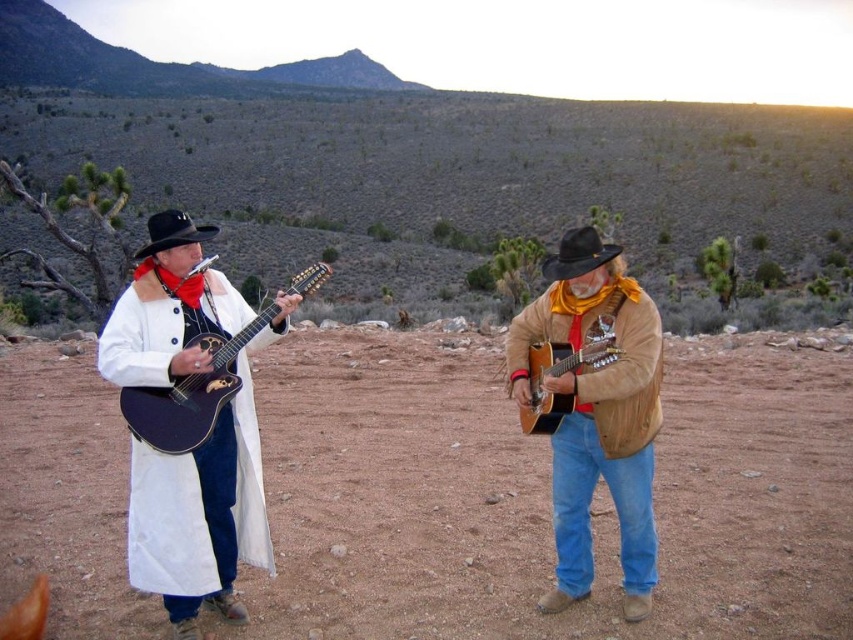
Question: Can you confirm if brown dirt field at center is positioned to the right of matte black acoustic guitar at left?

Choices:
 (A) no
 (B) yes

Answer: (B)

Question: Among these points, which one is nearest to the camera?

Choices:
 (A) (567, 515)
 (B) (560, 237)
 (C) (165, 216)
 (D) (660, 586)

Answer: (C)

Question: Does black felt cowboy hat at center come behind black felt cowboy hat at left?

Choices:
 (A) yes
 (B) no

Answer: (A)

Question: Considering the real-world distances, which object is farthest from the black felt cowboy hat at center?

Choices:
 (A) black felt cowboy hat at left
 (B) brown dirt field at center
 (C) matte black guitar at left
 (D) acoustic wood guitar at center

Answer: (A)

Question: Is matte black guitar at left thinner than black felt cowboy hat at center?

Choices:
 (A) no
 (B) yes

Answer: (A)

Question: Which of the following is the closest to the observer?

Choices:
 (A) black felt cowboy hat at left
 (B) black felt cowboy hat at center
 (C) matte black acoustic guitar at left
 (D) suede jacket at center

Answer: (C)